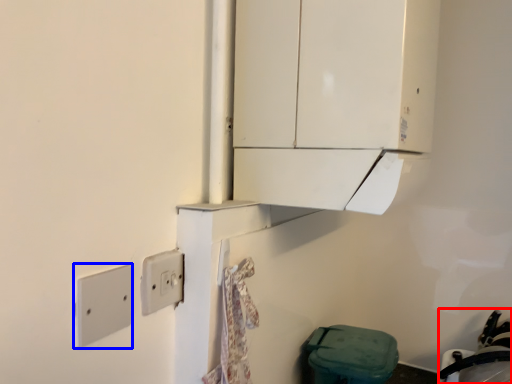
Question: Which object is closer to the camera taking this photo, sink (highlighted by a red box) or light switch (highlighted by a blue box)?

Choices:
 (A) sink
 (B) light switch

Answer: (B)